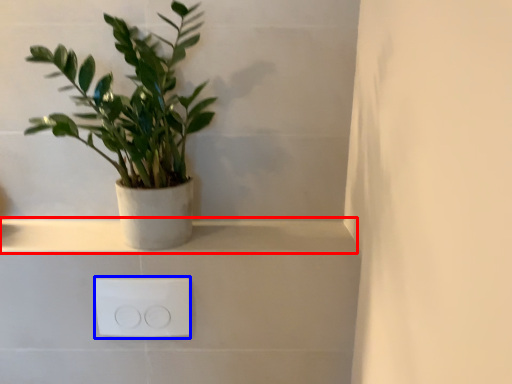
Question: Which of the following is the closest to the observer, window sill (highlighted by a red box) or electric outlet (highlighted by a blue box)?

Choices:
 (A) window sill
 (B) electric outlet

Answer: (B)